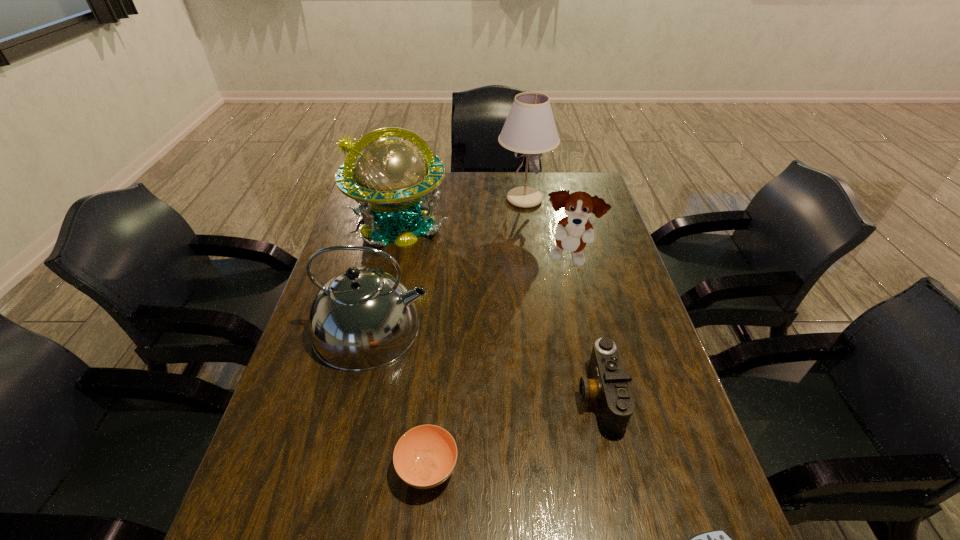
The image size is (960, 540). I want to click on vacant region located on the face of the puppy, so click(x=585, y=330).

Where is `free location located 0.380m on the lens of the camera`? Image resolution: width=960 pixels, height=540 pixels. free location located 0.380m on the lens of the camera is located at coordinates (414, 396).

Locate an element on the screen. vacant area located 0.050m on the lens of the camera is located at coordinates (556, 396).

Find the location of a particular element. The image size is (960, 540). vacant position located on the lens of the camera is located at coordinates (539, 396).

At what (x,y) coordinates should I click in order to perform the action: click on vacant space located 0.160m on the left of the second shortest object. Please return your answer as a coordinate pair (x, y). This screenshot has width=960, height=540. Looking at the image, I should click on (319, 468).

Image resolution: width=960 pixels, height=540 pixels. In order to click on lampshade located in the far edge section of the desktop in this screenshot , I will do `click(530, 128)`.

You are a GUI agent. You are given a task and a screenshot of the screen. Output one action in this format:
    pyautogui.click(x=<x>, y=<y>)
    Task: Click on the globe at the far edge
    The image size is (960, 540).
    Given the screenshot: What is the action you would take?
    pyautogui.click(x=391, y=179)

This screenshot has width=960, height=540. I want to click on globe that is at the left edge, so click(x=391, y=179).

Where is `kettle located at the left edge`? The width and height of the screenshot is (960, 540). kettle located at the left edge is located at coordinates (362, 319).

The image size is (960, 540). In order to click on puppy located in the right edge section of the desktop in this screenshot , I will do `click(572, 233)`.